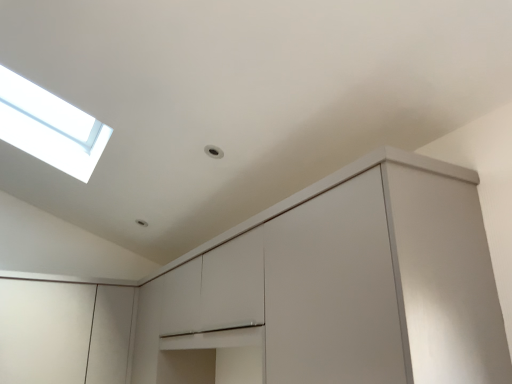
Where is `white matte cabinet at lower left, the second cabinetry positioned from the right`? This screenshot has width=512, height=384. white matte cabinet at lower left, the second cabinetry positioned from the right is located at coordinates (63, 332).

Describe the element at coordinates (63, 332) in the screenshot. I see `white matte cabinet at lower left, which is the first cabinetry from left to right` at that location.

The height and width of the screenshot is (384, 512). What do you see at coordinates (339, 286) in the screenshot? I see `matte white cabinet at center, which appears as the second cabinetry when viewed from the left` at bounding box center [339, 286].

The image size is (512, 384). Identify the location of matte white cabinet at center, which is the 1th cabinetry in right-to-left order. (339, 286).

This screenshot has height=384, width=512. Find the location of `white matte cabinet at lower left, which is the first cabinetry from left to right`. white matte cabinet at lower left, which is the first cabinetry from left to right is located at coordinates (63, 332).

Which object is positioned more to the left, matte white cabinet at center, which appears as the second cabinetry when viewed from the left, or white matte cabinet at lower left, the second cabinetry positioned from the right?

From the viewer's perspective, white matte cabinet at lower left, the second cabinetry positioned from the right, appears more on the left side.

Is the depth of matte white cabinet at center, which appears as the second cabinetry when viewed from the left, greater than that of white matte cabinet at lower left, which is the first cabinetry from left to right?

No, the depth of matte white cabinet at center, which appears as the second cabinetry when viewed from the left, is less than that of white matte cabinet at lower left, which is the first cabinetry from left to right.

Is point (394, 190) closer to camera compared to point (8, 279)?

Yes, point (394, 190) is in front of point (8, 279).

From the image's perspective, is matte white cabinet at center, which appears as the second cabinetry when viewed from the left, over white matte cabinet at lower left, which is the first cabinetry from left to right?

Yes, from the image's perspective, matte white cabinet at center, which appears as the second cabinetry when viewed from the left, is above white matte cabinet at lower left, which is the first cabinetry from left to right.

From a real-world perspective, which object rests below the other?

From a 3D spatial view, white matte cabinet at lower left, the second cabinetry positioned from the right, is below.

In terms of width, does matte white cabinet at center, which is the 1th cabinetry in right-to-left order, look wider or thinner when compared to white matte cabinet at lower left, the second cabinetry positioned from the right?

Clearly, matte white cabinet at center, which is the 1th cabinetry in right-to-left order, has less width compared to white matte cabinet at lower left, the second cabinetry positioned from the right.

Is matte white cabinet at center, which is the 1th cabinetry in right-to-left order, taller than white matte cabinet at lower left, the second cabinetry positioned from the right?

Yes.

Who is bigger, matte white cabinet at center, which is the 1th cabinetry in right-to-left order, or white matte cabinet at lower left, which is the first cabinetry from left to right?

matte white cabinet at center, which is the 1th cabinetry in right-to-left order.

Is white matte cabinet at lower left, the second cabinetry positioned from the right, completely or partially inside matte white cabinet at center, which appears as the second cabinetry when viewed from the left?

No, white matte cabinet at lower left, the second cabinetry positioned from the right, is not surrounded by matte white cabinet at center, which appears as the second cabinetry when viewed from the left.

Does matte white cabinet at center, which appears as the second cabinetry when viewed from the left, touch white matte cabinet at lower left, which is the first cabinetry from left to right?

matte white cabinet at center, which appears as the second cabinetry when viewed from the left, and white matte cabinet at lower left, which is the first cabinetry from left to right, are not in contact.

Could you tell me if matte white cabinet at center, which is the 1th cabinetry in right-to-left order, is facing white matte cabinet at lower left, which is the first cabinetry from left to right?

Yes, matte white cabinet at center, which is the 1th cabinetry in right-to-left order, is facing white matte cabinet at lower left, which is the first cabinetry from left to right.

What's the angular difference between matte white cabinet at center, which appears as the second cabinetry when viewed from the left, and white matte cabinet at lower left, which is the first cabinetry from left to right,'s facing directions?

89.6 degrees.

Measure the distance between matte white cabinet at center, which is the 1th cabinetry in right-to-left order, and white matte cabinet at lower left, which is the first cabinetry from left to right.

A distance of 4.39 feet exists between matte white cabinet at center, which is the 1th cabinetry in right-to-left order, and white matte cabinet at lower left, which is the first cabinetry from left to right.

Where is `cabinetry in front of the white matte cabinet at lower left, which is the first cabinetry from left to right`? The width and height of the screenshot is (512, 384). cabinetry in front of the white matte cabinet at lower left, which is the first cabinetry from left to right is located at coordinates (339, 286).

Which is more to the right, white matte cabinet at lower left, which is the first cabinetry from left to right, or matte white cabinet at center, which is the 1th cabinetry in right-to-left order?

matte white cabinet at center, which is the 1th cabinetry in right-to-left order, is more to the right.

In the scene shown: Which is in front, white matte cabinet at lower left, which is the first cabinetry from left to right, or matte white cabinet at center, which appears as the second cabinetry when viewed from the left?

matte white cabinet at center, which appears as the second cabinetry when viewed from the left, is closer to the camera.

Looking at this image, which is nearer, [46,329] or [241,326]?

Point [46,329] is farther from the camera than point [241,326].

In the scene shown: From the image's perspective, between white matte cabinet at lower left, which is the first cabinetry from left to right, and matte white cabinet at center, which appears as the second cabinetry when viewed from the left, who is located below?

From the image's view, white matte cabinet at lower left, which is the first cabinetry from left to right, is below.

From a real-world perspective, is white matte cabinet at lower left, the second cabinetry positioned from the right, positioned over matte white cabinet at center, which appears as the second cabinetry when viewed from the left, based on gravity?

No, from a real-world perspective, white matte cabinet at lower left, the second cabinetry positioned from the right, is not on top of matte white cabinet at center, which appears as the second cabinetry when viewed from the left.

Which of these two, white matte cabinet at lower left, which is the first cabinetry from left to right, or matte white cabinet at center, which is the 1th cabinetry in right-to-left order, is thinner?

matte white cabinet at center, which is the 1th cabinetry in right-to-left order, is thinner.

Considering the sizes of objects white matte cabinet at lower left, which is the first cabinetry from left to right, and matte white cabinet at center, which is the 1th cabinetry in right-to-left order, in the image provided, who is shorter, white matte cabinet at lower left, which is the first cabinetry from left to right, or matte white cabinet at center, which is the 1th cabinetry in right-to-left order,?

white matte cabinet at lower left, which is the first cabinetry from left to right, is shorter.

Can you confirm if white matte cabinet at lower left, which is the first cabinetry from left to right, is smaller than matte white cabinet at center, which appears as the second cabinetry when viewed from the left?

Yes.

Does white matte cabinet at lower left, the second cabinetry positioned from the right, contain matte white cabinet at center, which appears as the second cabinetry when viewed from the left?

No, matte white cabinet at center, which appears as the second cabinetry when viewed from the left, is not a part of white matte cabinet at lower left, the second cabinetry positioned from the right.

Is white matte cabinet at lower left, the second cabinetry positioned from the right, placed right next to matte white cabinet at center, which is the 1th cabinetry in right-to-left order?

No.

Is white matte cabinet at lower left, which is the first cabinetry from left to right, turned away from matte white cabinet at center, which is the 1th cabinetry in right-to-left order?

That's not correct — white matte cabinet at lower left, which is the first cabinetry from left to right, is not looking away from matte white cabinet at center, which is the 1th cabinetry in right-to-left order.

Locate an element on the screen. This screenshot has height=384, width=512. cabinetry behind the matte white cabinet at center, which is the 1th cabinetry in right-to-left order is located at coordinates (63, 332).

At what (x,y) coordinates should I click in order to perform the action: click on cabinetry in front of the white matte cabinet at lower left, the second cabinetry positioned from the right. Please return your answer as a coordinate pair (x, y). This screenshot has height=384, width=512. Looking at the image, I should click on (339, 286).

There is a white matte cabinet at lower left, the second cabinetry positioned from the right. At what (x,y) coordinates should I click in order to perform the action: click on cabinetry above it (from a real-world perspective). Please return your answer as a coordinate pair (x, y). This screenshot has width=512, height=384. Looking at the image, I should click on (339, 286).